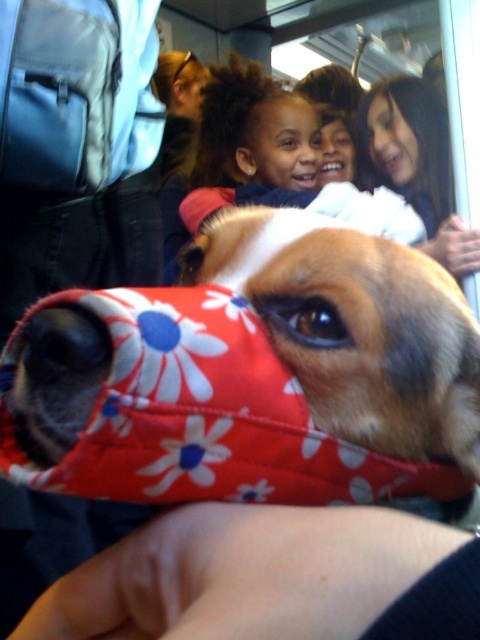
From the picture: Who is more forward, (314, 100) or (314, 170)?

Positioned in front is point (314, 170).

Does matte brown hair at upper center have a smaller size compared to brown smooth nose at center?

No.

This screenshot has height=640, width=480. I want to click on matte brown hair at upper center, so click(334, 113).

Is point (263, 182) in front of point (344, 140)?

Yes, point (263, 182) is in front of point (344, 140).

Who is positioned more to the right, dark brown hair at upper center or brown fur nose at center?

brown fur nose at center

Identify the location of dark brown hair at upper center. Image resolution: width=480 pixels, height=640 pixels. (252, 129).

Which of these two, matte black hair at upper center or brown smooth nose at upper center, stands shorter?

brown smooth nose at upper center is shorter.

What do you see at coordinates (180, 83) in the screenshot? This screenshot has width=480, height=640. I see `matte black hair at upper center` at bounding box center [180, 83].

Is point (180, 54) behind point (388, 124)?

That is True.

Find the location of a particular element. The height and width of the screenshot is (640, 480). matte black hair at upper center is located at coordinates (180, 83).